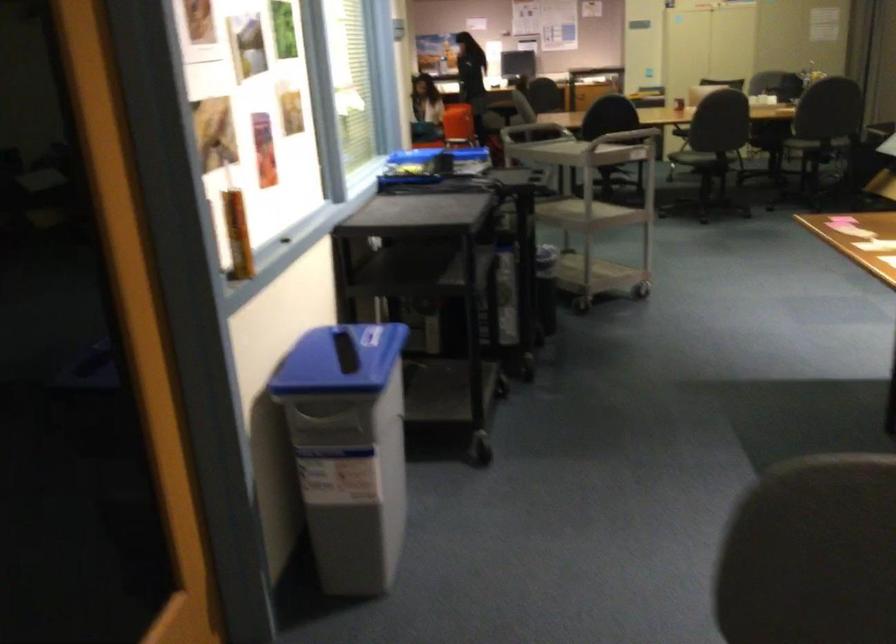
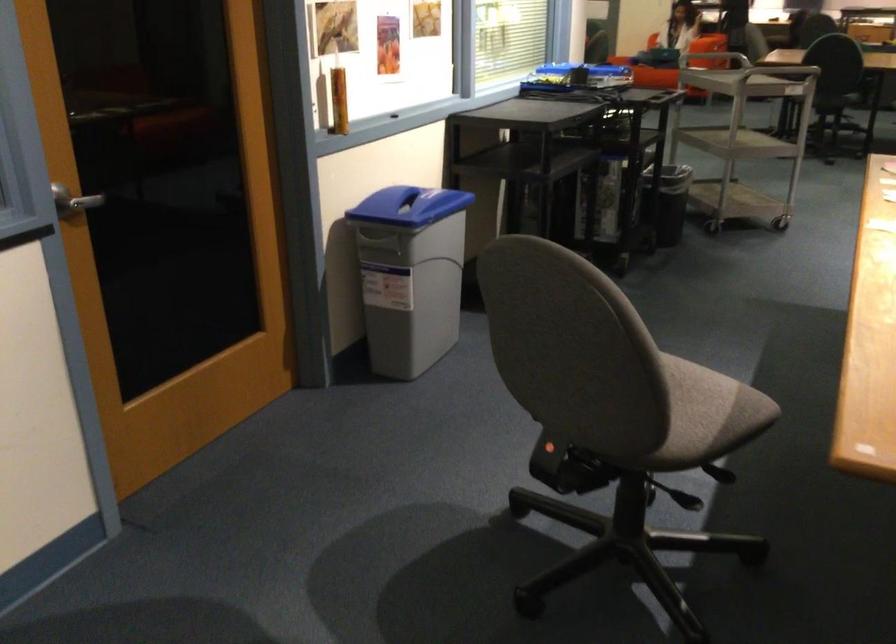
Locate, in the second image, the point that corresponds to the point at 513,305 in the first image.

(607, 200)